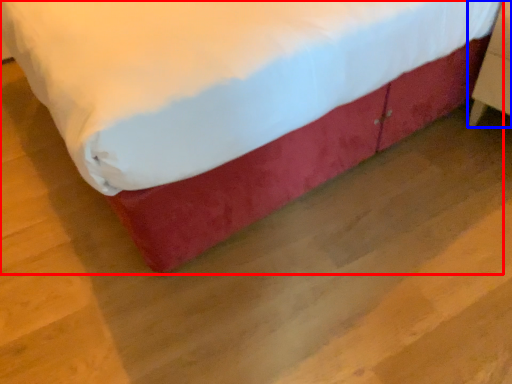
Question: Which of the following is the farthest to the observer, bed (highlighted by a red box) or furniture (highlighted by a blue box)?

Choices:
 (A) bed
 (B) furniture

Answer: (B)